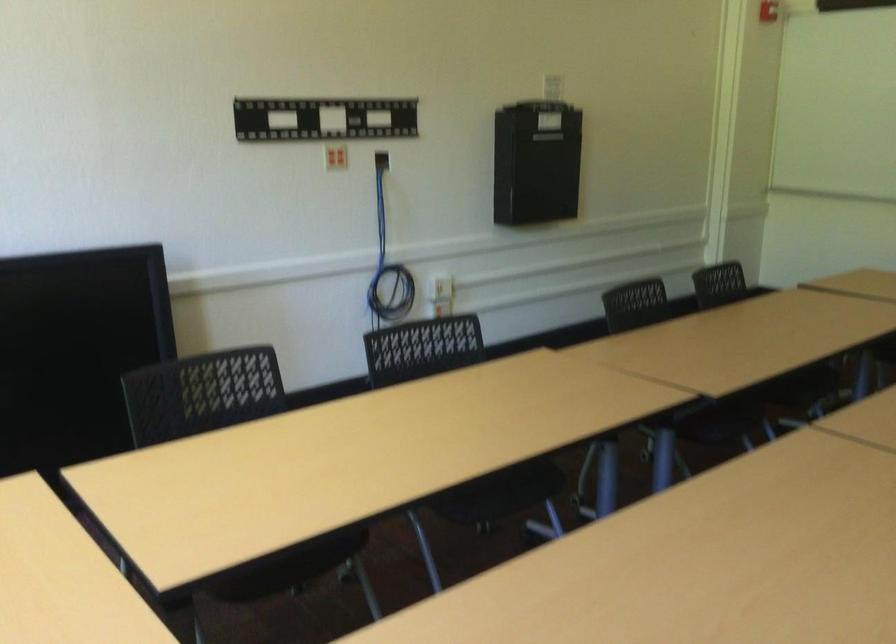
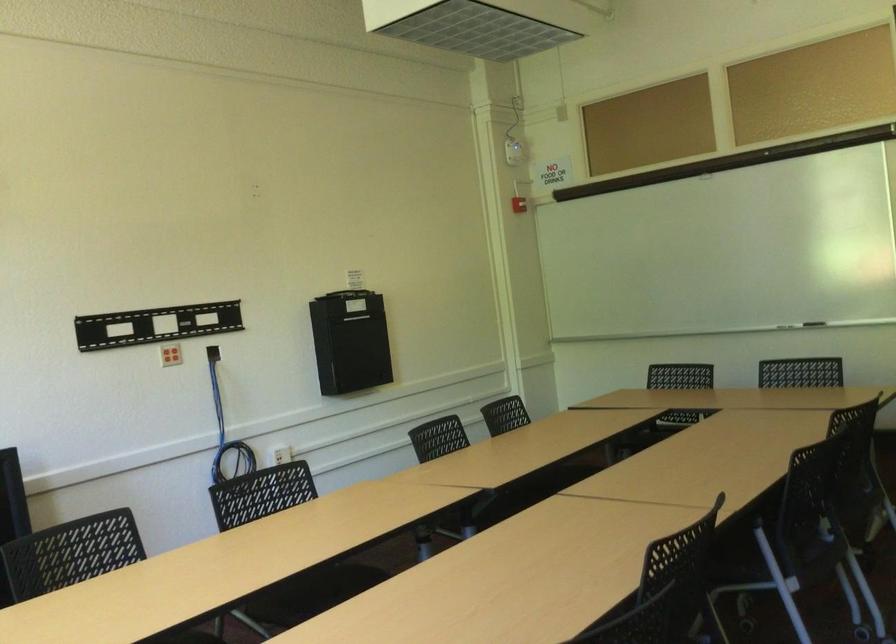
Question: How did the camera likely rotate?

Choices:
 (A) Left
 (B) Right
 (C) Up
 (D) Down

Answer: (C)